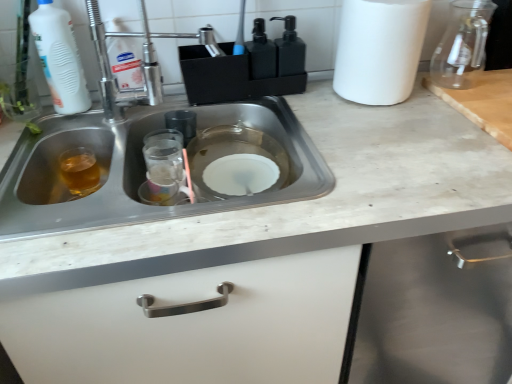
This screenshot has height=384, width=512. I want to click on vacant area that lies between white matte paper towel at upper right and transparent glass jar at upper right, so click(x=429, y=84).